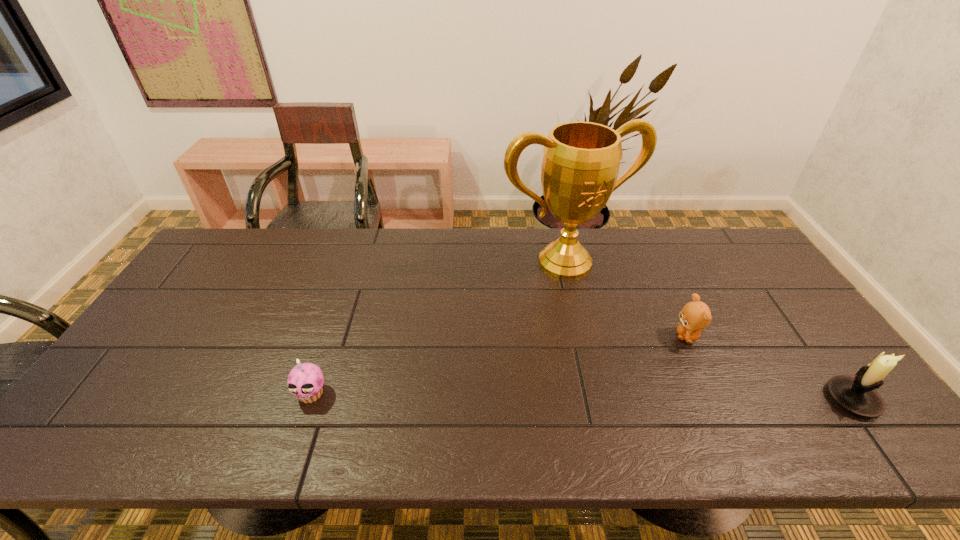
Find the location of `vacant region at the near edge of the desktop`. vacant region at the near edge of the desktop is located at coordinates (650, 385).

Locate an element on the screen. This screenshot has width=960, height=540. vacant space at the left edge of the desktop is located at coordinates (194, 275).

Image resolution: width=960 pixels, height=540 pixels. In order to click on vacant space at the right edge of the desktop in this screenshot , I will do pos(821,348).

This screenshot has width=960, height=540. I want to click on vacant space at the far left corner of the desktop, so click(234, 228).

Find the location of a particular element. free location at the far right corner is located at coordinates (713, 263).

Locate an element on the screen. free space between the second object from left to right and the cupcake is located at coordinates (438, 328).

Where is `free area in between the third shortest object and the leftmost object`? The height and width of the screenshot is (540, 960). free area in between the third shortest object and the leftmost object is located at coordinates (582, 396).

You are a GUI agent. You are given a task and a screenshot of the screen. Output one action in this format:
    pyautogui.click(x=<x>, y=<y>)
    Task: Click on the free space between the award and the teddy bear
    The width and height of the screenshot is (960, 540).
    Given the screenshot: What is the action you would take?
    pyautogui.click(x=626, y=299)

This screenshot has height=540, width=960. In order to click on free point between the award and the leftmost object in this screenshot , I will do `click(438, 328)`.

Locate an element on the screen. The image size is (960, 540). free space that is in between the cupcake and the third object from right to left is located at coordinates (438, 328).